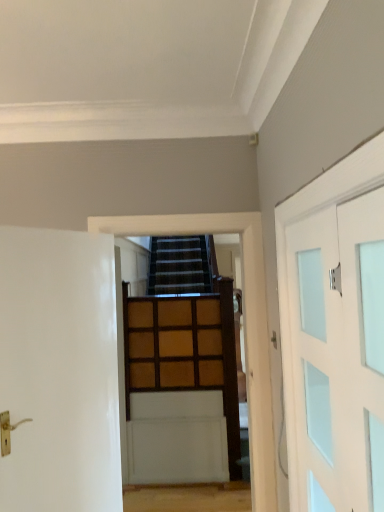
Question: Is wooden paneling at center at the back of white frosted glass door at right, the 1th door when ordered from right to left?

Choices:
 (A) yes
 (B) no

Answer: (B)

Question: Would you consider white frosted glass door at right, the 2th door in the left-to-right sequence, to be distant from wooden paneling at center?

Choices:
 (A) yes
 (B) no

Answer: (A)

Question: From the image's perspective, is white frosted glass door at right, the 2th door in the left-to-right sequence, on wooden paneling at center?

Choices:
 (A) no
 (B) yes

Answer: (B)

Question: Considering the relative sizes of white frosted glass door at right, the 1th door when ordered from right to left, and wooden paneling at center in the image provided, is white frosted glass door at right, the 1th door when ordered from right to left, thinner than wooden paneling at center?

Choices:
 (A) no
 (B) yes

Answer: (B)

Question: From a real-world perspective, is white frosted glass door at right, the 2th door in the left-to-right sequence, located beneath wooden paneling at center?

Choices:
 (A) no
 (B) yes

Answer: (A)

Question: Could you tell me if white frosted glass door at right, the 2th door in the left-to-right sequence, is turned towards wooden paneling at center?

Choices:
 (A) yes
 (B) no

Answer: (B)

Question: Is white frosted glass door at right, the 1th door when ordered from right to left, outside white glossy door at left, marked as the 1th door in a left-to-right arrangement?

Choices:
 (A) no
 (B) yes

Answer: (B)

Question: Is white frosted glass door at right, the 2th door in the left-to-right sequence, facing towards white glossy door at left, marked as the 1th door in a left-to-right arrangement?

Choices:
 (A) no
 (B) yes

Answer: (B)

Question: Does white frosted glass door at right, the 1th door when ordered from right to left, lie behind white glossy door at left, marked as the 1th door in a left-to-right arrangement?

Choices:
 (A) yes
 (B) no

Answer: (B)

Question: Can you confirm if white frosted glass door at right, the 2th door in the left-to-right sequence, is taller than white glossy door at left, marked as the 1th door in a left-to-right arrangement?

Choices:
 (A) no
 (B) yes

Answer: (A)

Question: Is white frosted glass door at right, the 2th door in the left-to-right sequence, positioned with its back to white glossy door at left, the second door when ordered from right to left?

Choices:
 (A) yes
 (B) no

Answer: (B)

Question: Does white frosted glass door at right, the 2th door in the left-to-right sequence, have a larger size compared to white glossy door at left, marked as the 1th door in a left-to-right arrangement?

Choices:
 (A) yes
 (B) no

Answer: (B)

Question: From a real-world perspective, is wooden paneling at center positioned under wooden paneling at center based on gravity?

Choices:
 (A) no
 (B) yes

Answer: (A)